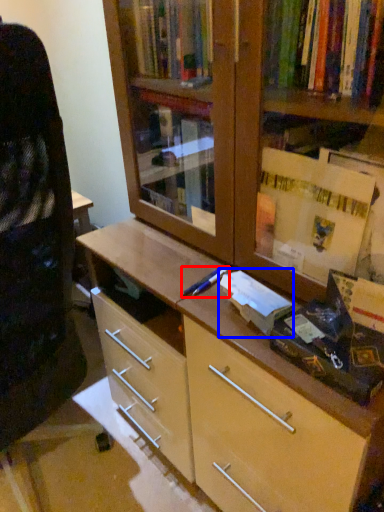
Question: Among these objects, which one is nearest to the camera, pen (highlighted by a red box) or book (highlighted by a blue box)?

Choices:
 (A) pen
 (B) book

Answer: (B)